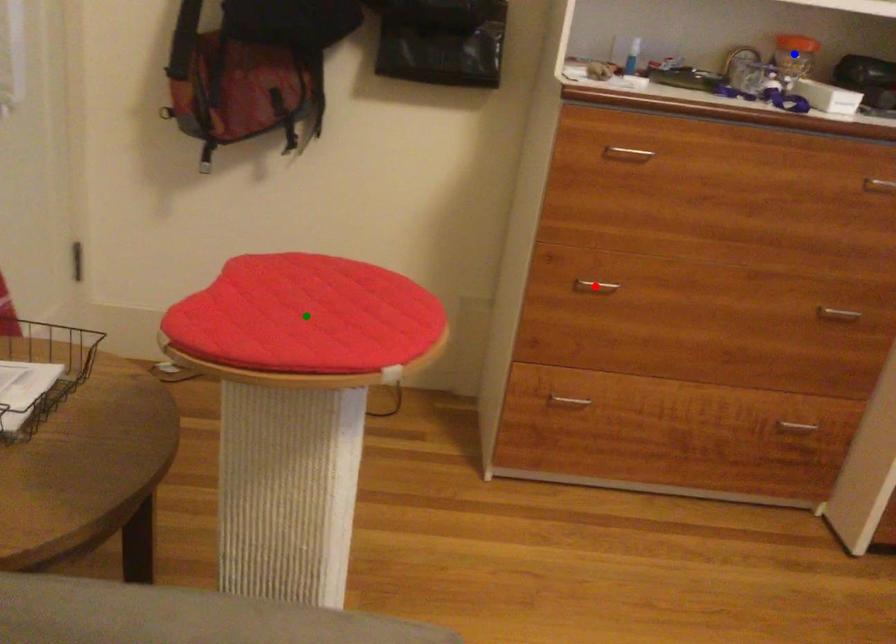
Order these from farthest to nearest:
red point | green point | blue point

blue point < red point < green point